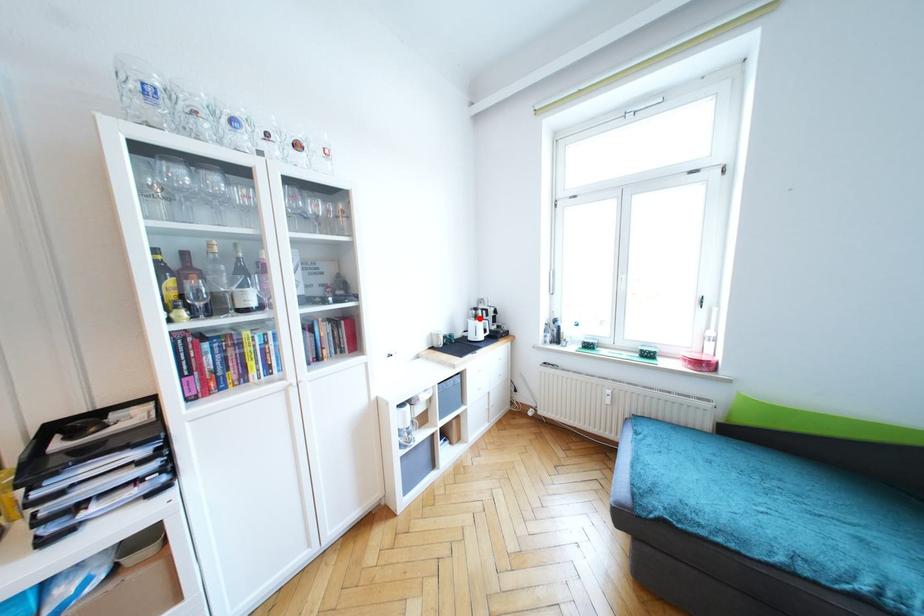
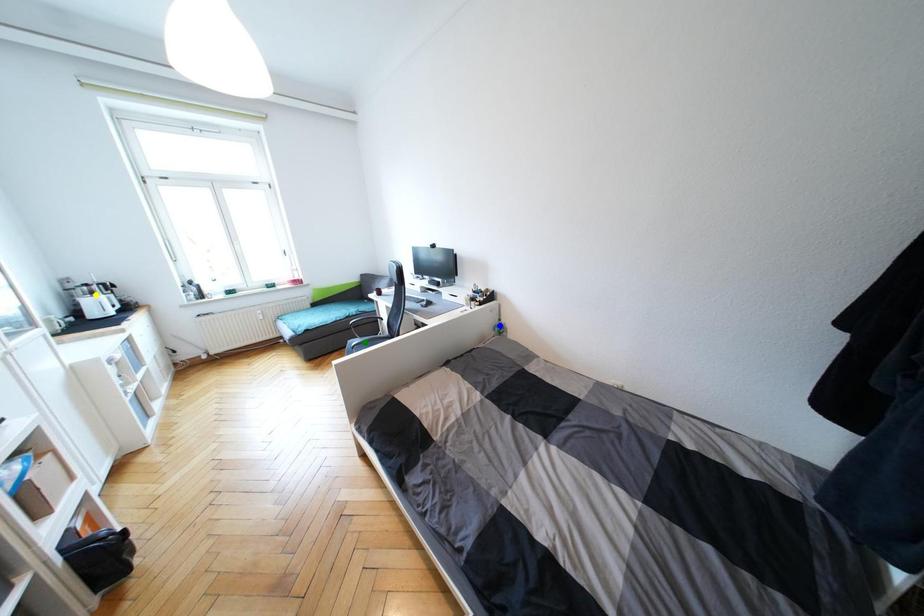
Question: I am providing you with two images of the same scene from different viewpoints. A red point is marked on the first image. You are given multiple points on the second image. In image 2, which mark is for the same physical point as the one in image 1?

Choices:
 (A) blue point
 (B) green point
 (C) yellow point

Answer: (C)